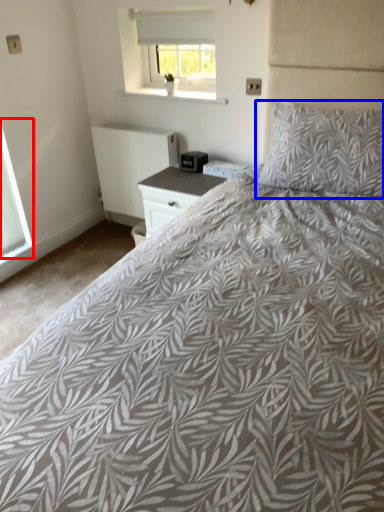
Question: Which object appears farthest to the camera in this image, window (highlighted by a red box) or pillow (highlighted by a blue box)?

Choices:
 (A) window
 (B) pillow

Answer: (A)